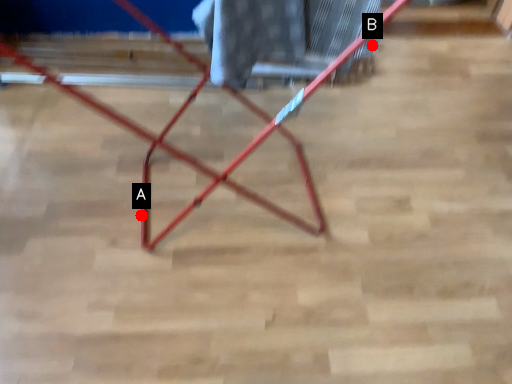
Question: Two points are circled on the image, labeled by A and B beside each circle. Among these points, which one is farthest from the camera?

Choices:
 (A) A is further
 (B) B is further

Answer: (A)